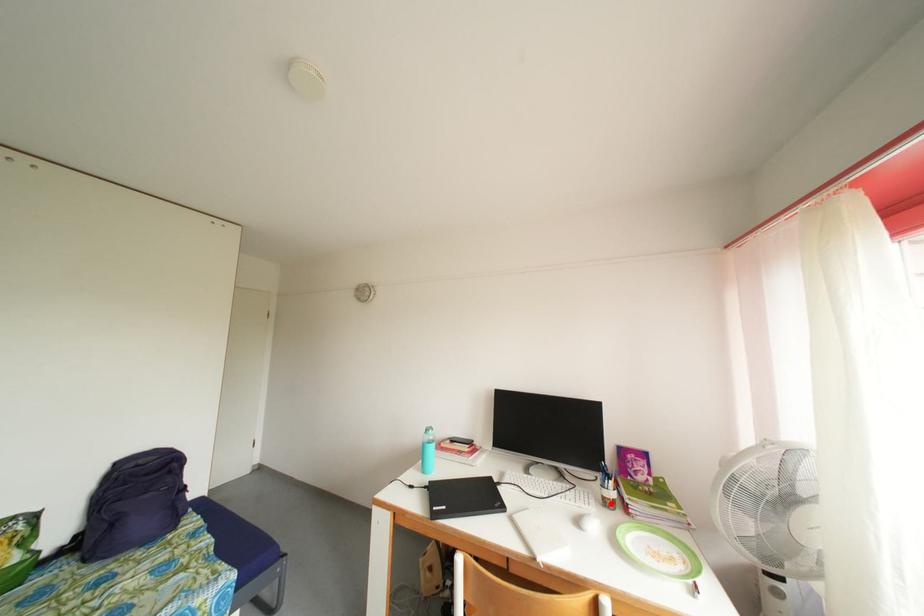
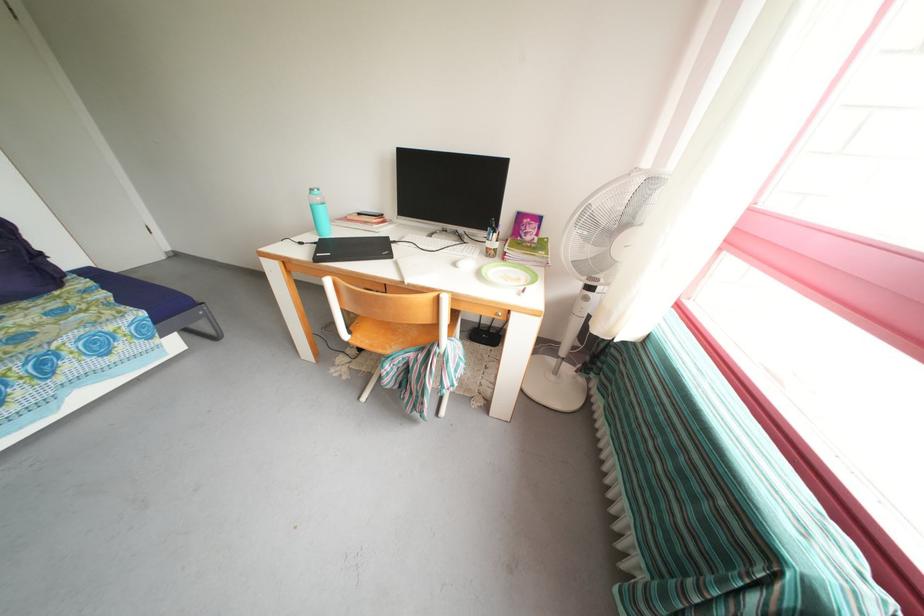
In the second image, find the point that corresponds to the highlighted location in the first image.

(494, 254)